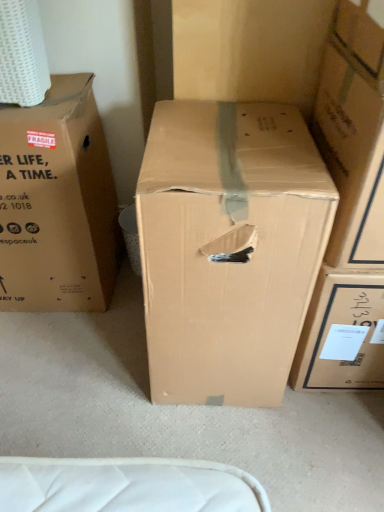
Question: Could cardboard box at center, the 1th box viewed from the right, be considered to be inside brown cardboard box at center, which is the 2th box from right to left?

Choices:
 (A) yes
 (B) no

Answer: (B)

Question: Does brown cardboard box at center, positioned as the second box in left-to-right order, appear on the right side of cardboard box at center, which appears as the 3th box when viewed from the left?

Choices:
 (A) yes
 (B) no

Answer: (B)

Question: From a real-world perspective, does brown cardboard box at center, positioned as the second box in left-to-right order, sit lower than cardboard box at center, the 1th box viewed from the right?

Choices:
 (A) no
 (B) yes

Answer: (B)

Question: Is brown cardboard box at center, which is the 2th box from right to left, shorter than cardboard box at center, the 1th box viewed from the right?

Choices:
 (A) no
 (B) yes

Answer: (A)

Question: Are brown cardboard box at center, positioned as the second box in left-to-right order, and cardboard box at center, the 1th box viewed from the right, located far from each other?

Choices:
 (A) no
 (B) yes

Answer: (A)

Question: Is brown cardboard box at center, positioned as the second box in left-to-right order, taller or shorter than cardboard box at center, which appears as the 3th box when viewed from the left?

Choices:
 (A) tall
 (B) short

Answer: (A)

Question: In the image, is brown cardboard box at center, which is the 2th box from right to left, positioned in front of or behind cardboard box at center, which appears as the 3th box when viewed from the left?

Choices:
 (A) front
 (B) behind

Answer: (B)

Question: Looking at the image, does brown cardboard box at center, which is the 2th box from right to left, seem bigger or smaller compared to cardboard box at center, the 1th box viewed from the right?

Choices:
 (A) small
 (B) big

Answer: (B)

Question: Does point (276, 112) appear closer or farther from the camera than point (362, 67)?

Choices:
 (A) closer
 (B) farther

Answer: (B)

Question: From their relative heights in the image, would you say brown cardboard box at center, which is the 2th box from right to left, is taller or shorter than brown cardboard box at left, positioned as the 1th box in left-to-right order?

Choices:
 (A) short
 (B) tall

Answer: (B)

Question: Looking at the image, does brown cardboard box at center, which is the 2th box from right to left, seem bigger or smaller compared to brown cardboard box at left, positioned as the 1th box in left-to-right order?

Choices:
 (A) big
 (B) small

Answer: (A)

Question: From the image's perspective, is brown cardboard box at center, positioned as the second box in left-to-right order, located above or below brown cardboard box at left, which is the 3th box from right to left?

Choices:
 (A) above
 (B) below

Answer: (B)

Question: In the image, is brown cardboard box at center, positioned as the second box in left-to-right order, positioned in front of or behind brown cardboard box at left, positioned as the 1th box in left-to-right order?

Choices:
 (A) behind
 (B) front

Answer: (B)

Question: From the image's perspective, is brown cardboard box at left, which is the 3th box from right to left, positioned above or below brown cardboard box at center, which is the 2th box from right to left?

Choices:
 (A) above
 (B) below

Answer: (A)

Question: Is point (105, 289) positioned closer to the camera than point (244, 135)?

Choices:
 (A) farther
 (B) closer

Answer: (A)